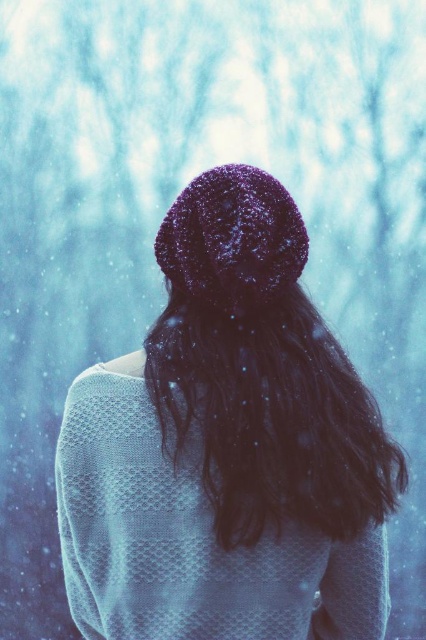
Does sparkly purple knit hat at center lie in front of dark matte hair at center?

No, sparkly purple knit hat at center is behind dark matte hair at center.

Does sparkly purple knit hat at center have a smaller size compared to dark matte hair at center?

Actually, sparkly purple knit hat at center might be larger than dark matte hair at center.

Does point (112, 440) come closer to viewer compared to point (305, 300)?

That is True.

Find the location of a particular element. This screenshot has height=640, width=426. sparkly purple knit hat at center is located at coordinates (227, 448).